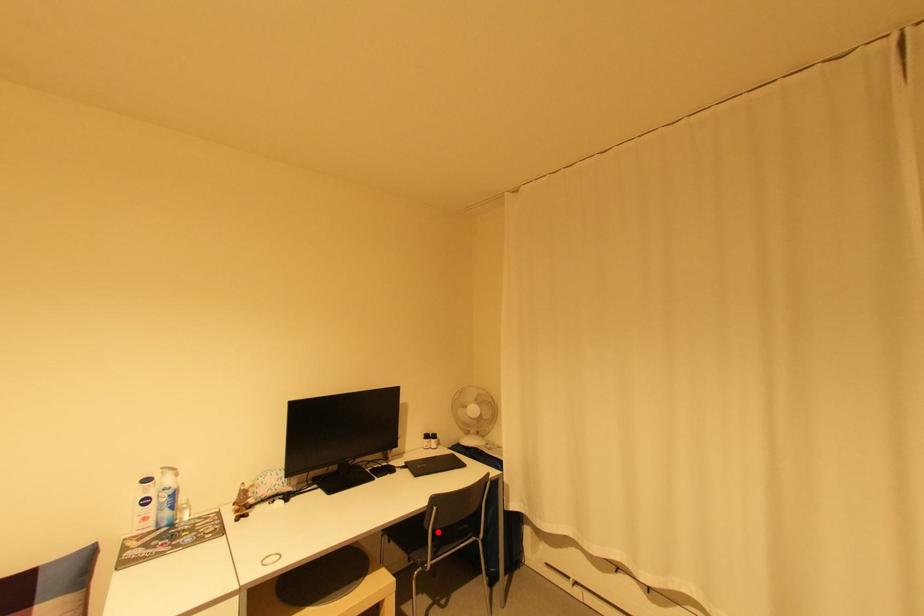
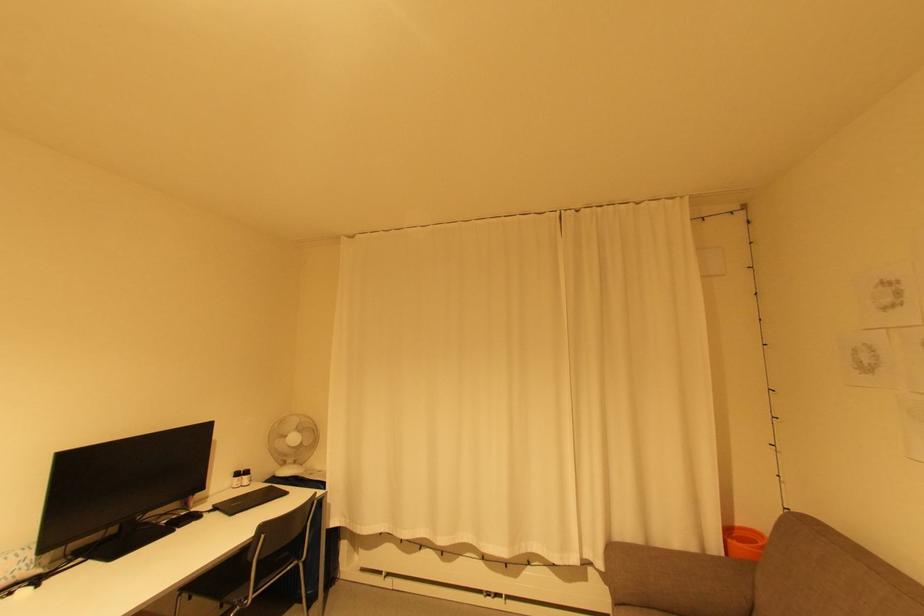
In the second image, find the point that corresponds to the highlighted location in the first image.

(262, 562)